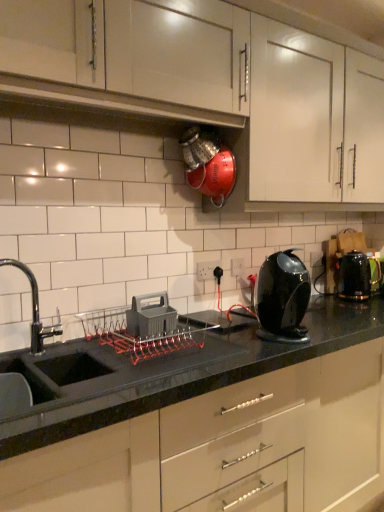
Question: From the image's perspective, is glossy black kettle at center-right located above or below white glossy cabinet at upper center, which is the 1th cabinetry from top to bottom?

Choices:
 (A) below
 (B) above

Answer: (A)

Question: Looking at their shapes, would you say glossy black kettle at center-right is wider or thinner than white glossy cabinet at upper center, the 3th cabinetry from the bottom?

Choices:
 (A) thin
 (B) wide

Answer: (A)

Question: Which object is positioned farthest from the gray plastic dish rack at center?

Choices:
 (A) black glossy kettle at right
 (B) black glossy countertop at center, which ranks as the 3th cabinetry in top-to-bottom order
 (C) white plastic electric outlet at center, the 1th electric outlet viewed from the front
 (D) white glossy cabinet at upper center, the 3th cabinetry from the bottom
 (E) white matte cabinet at upper center, marked as the 2th cabinetry in a bottom-to-top arrangement

Answer: (A)

Question: Which object is the farthest from the white plastic electric outlet at center, marked as the second electric outlet in a back-to-front arrangement?

Choices:
 (A) black plastic electric outlet at center, acting as the 2th electric outlet starting from the left
 (B) gray plastic dish rack at center
 (C) black glossy kettle at right
 (D) white glossy cabinet at upper center, the 3th cabinetry from the bottom
 (E) black glossy countertop at center, marked as the first cabinetry in a bottom-to-top arrangement

Answer: (D)